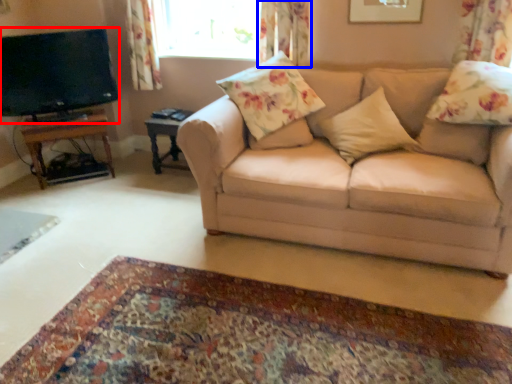
Question: Which of the following is the farthest to the observer, television (highlighted by a red box) or curtain (highlighted by a blue box)?

Choices:
 (A) television
 (B) curtain

Answer: (B)